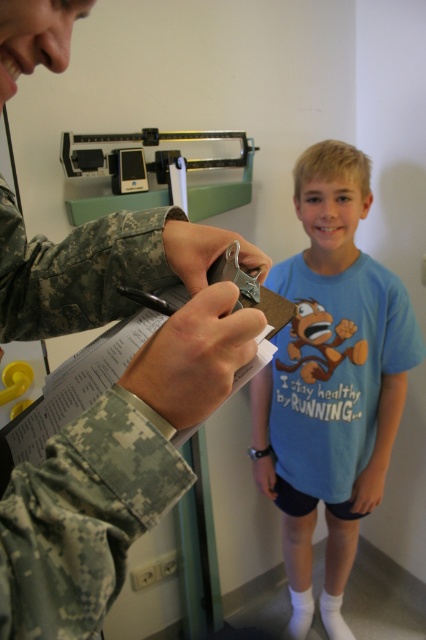
Which is in front, point (57, 604) or point (282, 509)?

Point (57, 604) is in front.

Can you confirm if camouflage uniform at center is smaller than blue cotton shirt at center?

Yes.

At what (x,y) coordinates should I click in order to perform the action: click on camouflage uniform at center. Please return your answer as a coordinate pair (x, y). The height and width of the screenshot is (640, 426). Looking at the image, I should click on (109, 404).